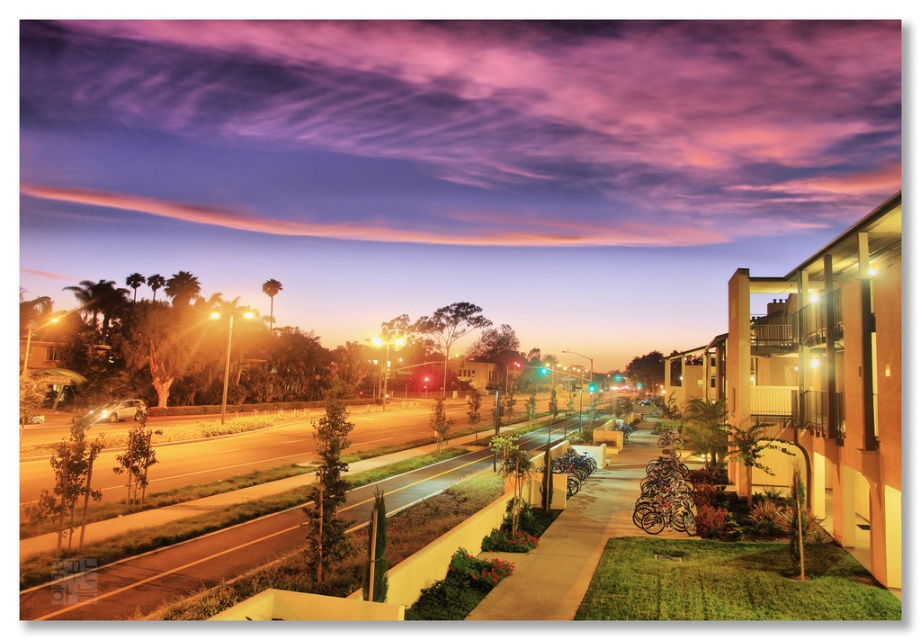
You are a city planner analyzing the urban layout. You notice the purple cloud at upper center and the smooth asphalt road at center. Which of these two elements occupies a larger area in the scene?

The purple cloud at upper center is bigger than the smooth asphalt road at center, so it occupies a larger area in the scene.